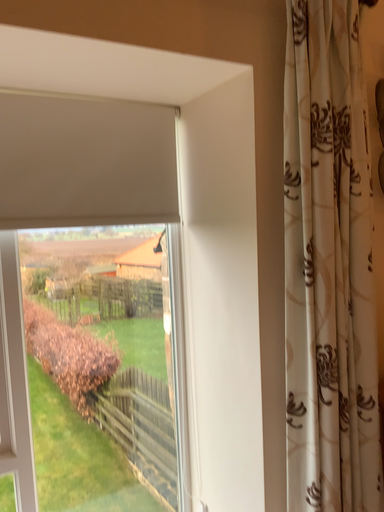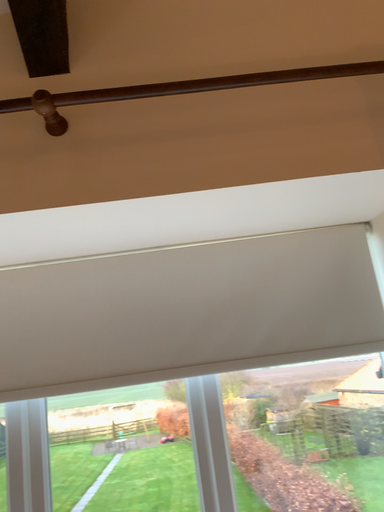
Question: Which way did the camera rotate in the video?

Choices:
 (A) rotated downward
 (B) rotated upward

Answer: (B)